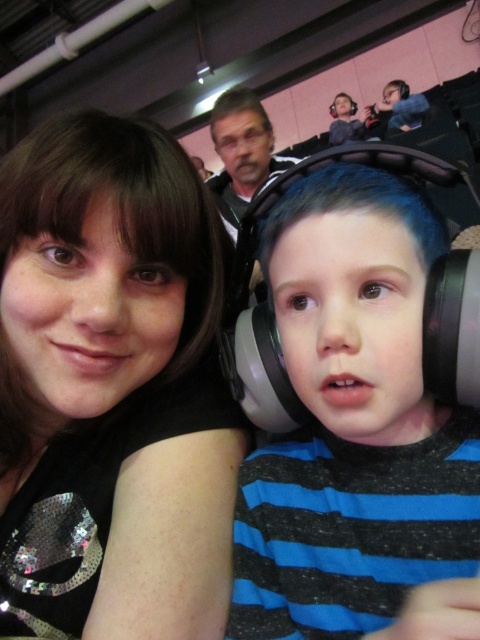
Question: Considering the relative positions of black sequined shirt at upper left and matte plastic headphones at center in the image provided, where is black sequined shirt at upper left located with respect to matte plastic headphones at center?

Choices:
 (A) left
 (B) right

Answer: (A)

Question: Does black sequined shirt at upper left have a smaller size compared to matte plastic headphones at center?

Choices:
 (A) yes
 (B) no

Answer: (B)

Question: Which of the following is the closest to the observer?

Choices:
 (A) black sequined shirt at upper left
 (B) matte plastic headphones at center

Answer: (B)

Question: Which point is farther from the camera taking this photo?

Choices:
 (A) (9, 580)
 (B) (289, 596)

Answer: (A)

Question: Is black sequined shirt at upper left above matte plastic headphones at center?

Choices:
 (A) no
 (B) yes

Answer: (B)